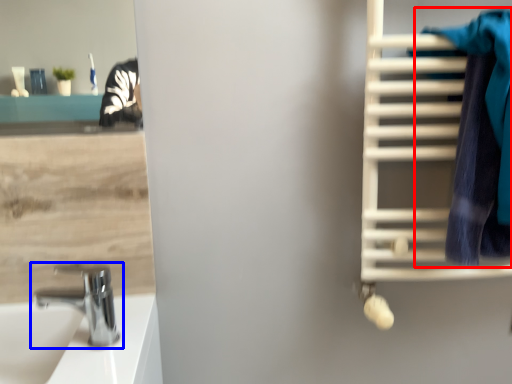
Question: Which of the following is the closest to the observer, bath towel (highlighted by a red box) or tap (highlighted by a blue box)?

Choices:
 (A) bath towel
 (B) tap

Answer: (A)